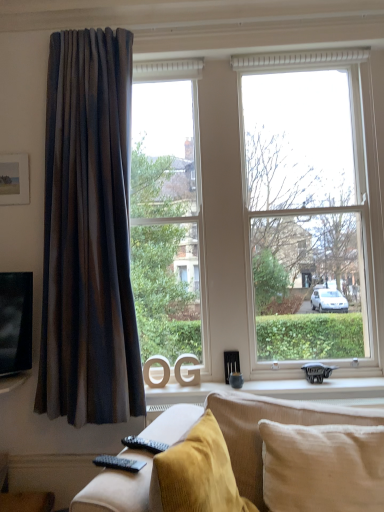
You are a GUI agent. You are given a task and a screenshot of the screen. Output one action in this format:
    pyautogui.click(x=<x>, y=<y>)
    Task: Click on the free space above white matte window sill at center (from a real-world perspective)
    This screenshot has height=512, width=384.
    Given the screenshot: What is the action you would take?
    pyautogui.click(x=256, y=385)